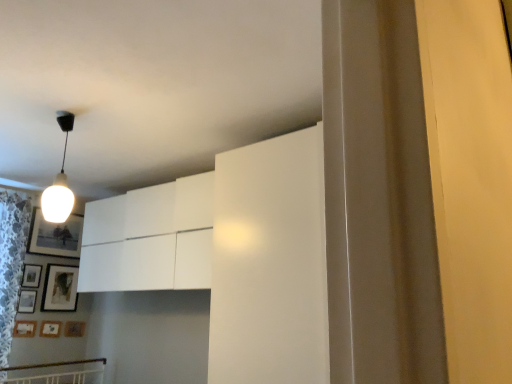
Question: Would you say wooden picture frame at lower left, the fourth picture frame when ordered from bottom to top, is to the left or to the right of wooden matte picture frame at lower left, which is the 5th picture frame in top-to-bottom order, in the picture?

Choices:
 (A) left
 (B) right

Answer: (A)

Question: In the image, is wooden picture frame at lower left, arranged as the 4th picture frame when viewed from the top, positioned in front of or behind wooden matte picture frame at lower left, the 3th picture frame positioned from the bottom?

Choices:
 (A) behind
 (B) front

Answer: (A)

Question: Which of these objects is positioned farthest from the white glossy light bulb at upper left?

Choices:
 (A) matte black picture frame at lower left, placed as the 5th picture frame when sorted from bottom to top
 (B) wooden picture frame at lower left, which ranks as the sixth picture frame in top-to-bottom order
 (C) wooden matte picture frame at lower left, placed as the seventh picture frame when sorted from top to bottom
 (D) wooden matte picture frame at lower left, the 3th picture frame positioned from the bottom
 (E) white lace curtain at left

Answer: (C)

Question: Which of these objects is positioned farthest from the matte black picture frame at lower left, which ranks as the 3th picture frame in top-to-bottom order?

Choices:
 (A) wooden matte picture frame at lower left, which is the 5th picture frame in top-to-bottom order
 (B) wooden picture frame at lower left, arranged as the 2th picture frame when ordered from the bottom
 (C) white glossy light bulb at upper left
 (D) wooden matte picture frame at lower left, arranged as the 1th picture frame when ordered from the bottom
 (E) wooden picture frame at lower left, the 6th picture frame positioned from the bottom

Answer: (C)